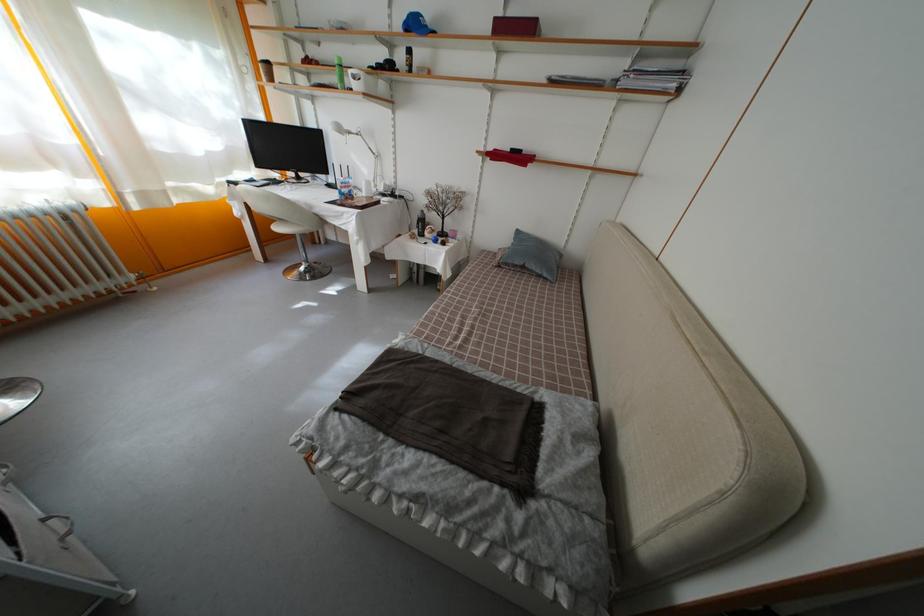
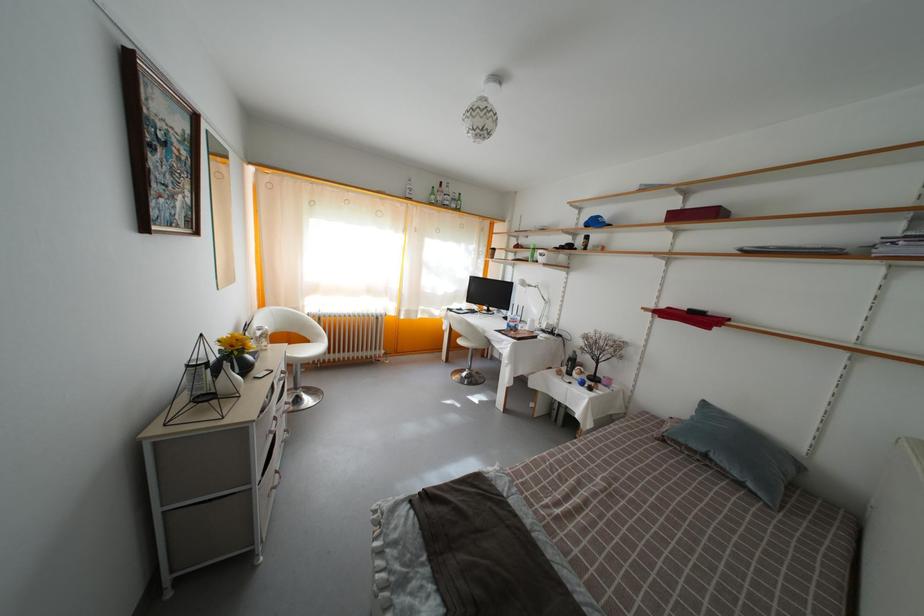
In the second image, find the point that corresponds to (351,134) in the first image.

(533, 289)